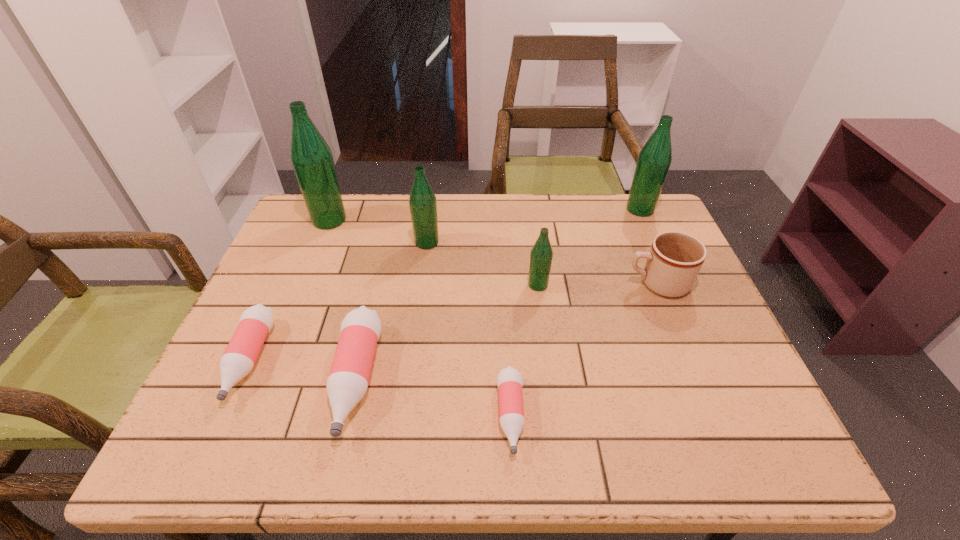
The width and height of the screenshot is (960, 540). What are the coordinates of `the leftmost green bottle` in the screenshot? It's located at (311, 158).

You are a GUI agent. You are given a task and a screenshot of the screen. Output one action in this format:
    pyautogui.click(x=<x>, y=<y>)
    Task: Click on the tallest object
    This screenshot has width=960, height=540.
    Given the screenshot: What is the action you would take?
    pyautogui.click(x=311, y=158)

I want to click on the rightmost green bottle, so click(x=654, y=160).

Find the location of a particular element. the seventh shortest object is located at coordinates (654, 160).

Image resolution: width=960 pixels, height=540 pixels. Find the location of `the fourth bottle from left to right`. the fourth bottle from left to right is located at coordinates (422, 202).

Identify the location of the fifth nearest bottle. (422, 202).

Identify the location of the second green bottle from right to left. The height and width of the screenshot is (540, 960). [x=541, y=255].

Identify the location of the nearest green bottle. The width and height of the screenshot is (960, 540). (541, 255).

Locate an element on the screen. The image size is (960, 540). the fifth tallest object is located at coordinates (675, 258).

The width and height of the screenshot is (960, 540). I want to click on brown mug, so click(675, 258).